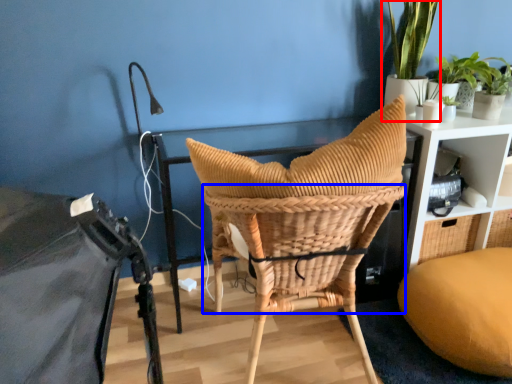
Question: Which object appears farthest to the camera in this image, houseplant (highlighted by a red box) or basket (highlighted by a blue box)?

Choices:
 (A) houseplant
 (B) basket

Answer: (A)